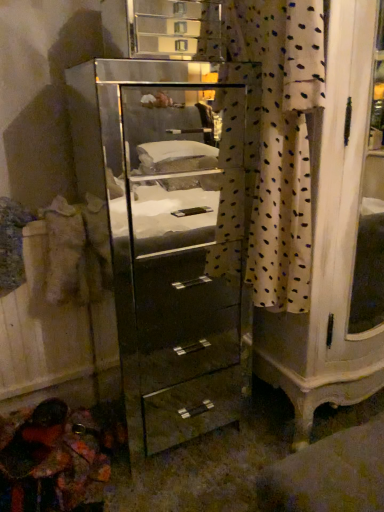
Describe the element at coordinates (268, 147) in the screenshot. I see `white dotted fabric at center` at that location.

Image resolution: width=384 pixels, height=512 pixels. In order to click on white dotted fabric at center in this screenshot , I will do `click(268, 147)`.

This screenshot has height=512, width=384. I want to click on mirror-finished glass chest of drawers at center, so click(x=162, y=249).

Describe the element at coordinates (162, 249) in the screenshot. I see `mirror-finished glass chest of drawers at center` at that location.

Measure the distance between point (x=201, y=403) and camera.

5.38 feet.

Locate an element on the screen. This screenshot has width=384, height=512. white dotted fabric at center is located at coordinates (268, 147).

Considering the positions of objects mirror-finished glass chest of drawers at center and white dotted fabric at center in the image provided, who is more to the right, mirror-finished glass chest of drawers at center or white dotted fabric at center?

white dotted fabric at center is more to the right.

Which is behind, mirror-finished glass chest of drawers at center or white dotted fabric at center?

mirror-finished glass chest of drawers at center.

Which is closer to the camera, [184,164] or [255,276]?

Point [184,164] is positioned farther from the camera compared to point [255,276].

From the image's perspective, between mirror-finished glass chest of drawers at center and white dotted fabric at center, which one is located above?

white dotted fabric at center is shown above in the image.

From the picture: From a real-world perspective, is mirror-finished glass chest of drawers at center below white dotted fabric at center?

Yes, from a real-world perspective, mirror-finished glass chest of drawers at center is below white dotted fabric at center.

Considering the relative sizes of mirror-finished glass chest of drawers at center and white dotted fabric at center in the image provided, is mirror-finished glass chest of drawers at center wider than white dotted fabric at center?

Correct, the width of mirror-finished glass chest of drawers at center exceeds that of white dotted fabric at center.

In terms of height, does mirror-finished glass chest of drawers at center look taller or shorter compared to white dotted fabric at center?

In the image, mirror-finished glass chest of drawers at center appears to be taller than white dotted fabric at center.

Who is bigger, mirror-finished glass chest of drawers at center or white dotted fabric at center?

With larger size is mirror-finished glass chest of drawers at center.

Can we say mirror-finished glass chest of drawers at center lies outside white dotted fabric at center?

Yes, mirror-finished glass chest of drawers at center is outside of white dotted fabric at center.

Are mirror-finished glass chest of drawers at center and white dotted fabric at center located far from each other?

Actually, mirror-finished glass chest of drawers at center and white dotted fabric at center are a little close together.

Is mirror-finished glass chest of drawers at center oriented away from white dotted fabric at center?

Absolutely, mirror-finished glass chest of drawers at center is directed away from white dotted fabric at center.

Locate an element on the screen. the chest of drawers behind the white dotted fabric at center is located at coordinates (162, 249).

Based on their positions, is white dotted fabric at center located to the left or right of mirror-finished glass chest of drawers at center?

white dotted fabric at center is positioned on mirror-finished glass chest of drawers at center's right side.

Is white dotted fabric at center positioned in front of mirror-finished glass chest of drawers at center?

Yes, the depth of white dotted fabric at center is less than that of mirror-finished glass chest of drawers at center.

Is point (248, 118) closer to viewer compared to point (153, 119)?

That is True.

From the image's perspective, which one is positioned lower, white dotted fabric at center or mirror-finished glass chest of drawers at center?

mirror-finished glass chest of drawers at center.

From a real-world perspective, between white dotted fabric at center and mirror-finished glass chest of drawers at center, who is vertically higher?

In real-world perspective, white dotted fabric at center is above.

Which of these two, white dotted fabric at center or mirror-finished glass chest of drawers at center, is thinner?

Thinner between the two is white dotted fabric at center.

Can you confirm if white dotted fabric at center is shorter than mirror-finished glass chest of drawers at center?

Yes.

Between white dotted fabric at center and mirror-finished glass chest of drawers at center, which one has smaller size?

With smaller size is white dotted fabric at center.

Is white dotted fabric at center located outside mirror-finished glass chest of drawers at center?

No, white dotted fabric at center is inside mirror-finished glass chest of drawers at center's boundary.

Is white dotted fabric at center not near mirror-finished glass chest of drawers at center?

Actually, white dotted fabric at center and mirror-finished glass chest of drawers at center are a little close together.

Does white dotted fabric at center turn towards mirror-finished glass chest of drawers at center?

Yes, white dotted fabric at center is aimed at mirror-finished glass chest of drawers at center.

Could you measure the distance between white dotted fabric at center and mirror-finished glass chest of drawers at center?

white dotted fabric at center and mirror-finished glass chest of drawers at center are 38.74 inches apart from each other.

What are the coordinates of `curtain located above the mirror-finished glass chest of drawers at center (from a real-world perspective)` in the screenshot? It's located at (268, 147).

Where is `chest of drawers on the left of white dotted fabric at center`? chest of drawers on the left of white dotted fabric at center is located at coordinates (162, 249).

Locate an element on the screen. curtain above the mirror-finished glass chest of drawers at center (from the image's perspective) is located at coordinates (268, 147).